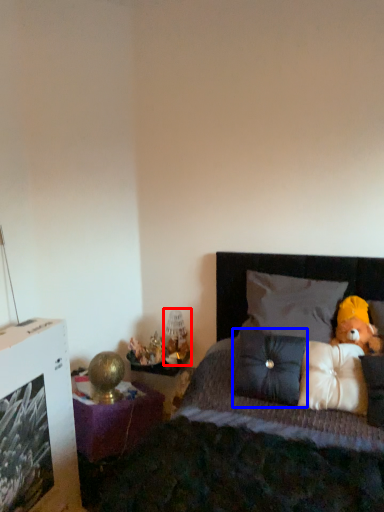
Question: Which of the following is the farthest to the observer, table lamp (highlighted by a red box) or pillow (highlighted by a blue box)?

Choices:
 (A) table lamp
 (B) pillow

Answer: (A)